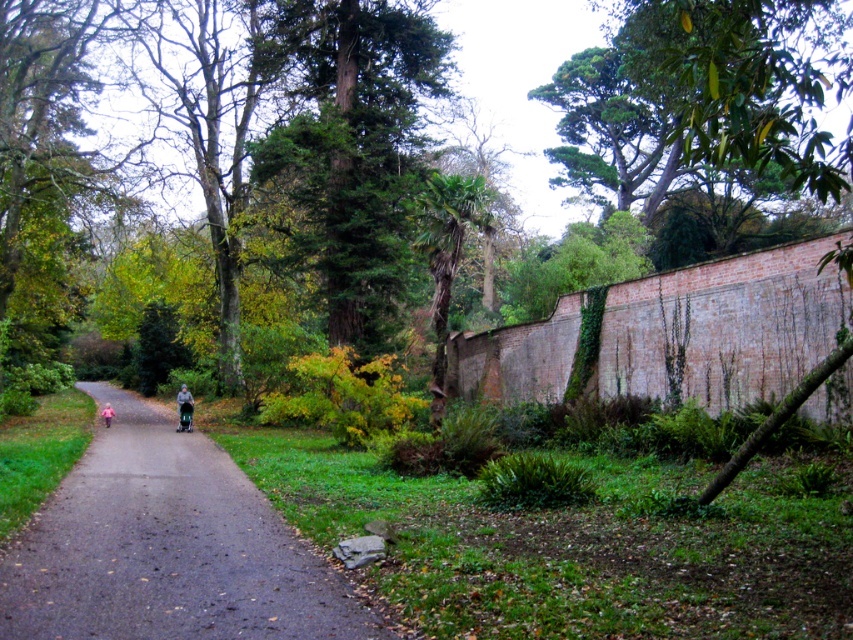
Question: Can you confirm if dark asphalt path at center is positioned to the left of pink fabric at center?

Choices:
 (A) no
 (B) yes

Answer: (A)

Question: Considering the relative positions of dark asphalt path at center and gray fabric stroller at center in the image provided, where is dark asphalt path at center located with respect to gray fabric stroller at center?

Choices:
 (A) below
 (B) above

Answer: (A)

Question: Which point is closer to the camera taking this photo?

Choices:
 (A) (171, 598)
 (B) (254, 157)
 (C) (189, 420)
 (D) (107, 419)

Answer: (A)

Question: Can you confirm if dark asphalt path at center is positioned above pink fabric at center?

Choices:
 (A) yes
 (B) no

Answer: (A)

Question: Which of the following is the farthest from the observer?

Choices:
 (A) tap(302, 3)
 (B) tap(166, 588)
 (C) tap(187, 406)

Answer: (A)

Question: Which object appears farthest from the camera in this image?

Choices:
 (A) green textured tree at center
 (B) gray fabric stroller at center
 (C) dark asphalt path at center

Answer: (B)